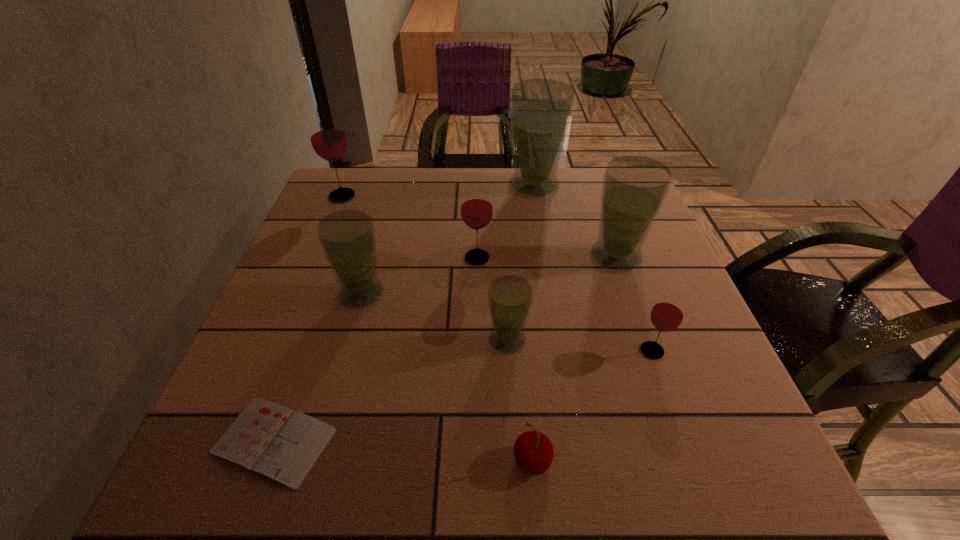
Identify the location of red glass that can be found as the second closest to the smallest blue glass. (667, 314).

Identify the location of red glass that is the second closest one to the diary. (667, 314).

Where is `free point that satisfies the following two spatial constraints: 1. on the back side of the rightmost red glass; 2. on the left side of the red cherry`? Image resolution: width=960 pixels, height=540 pixels. free point that satisfies the following two spatial constraints: 1. on the back side of the rightmost red glass; 2. on the left side of the red cherry is located at coordinates coord(522,351).

Where is `vacant area that satisfies the following two spatial constraints: 1. on the back side of the second red glass from left to right; 2. on the left side of the second glass from left to right`? This screenshot has width=960, height=540. vacant area that satisfies the following two spatial constraints: 1. on the back side of the second red glass from left to right; 2. on the left side of the second glass from left to right is located at coordinates (372, 258).